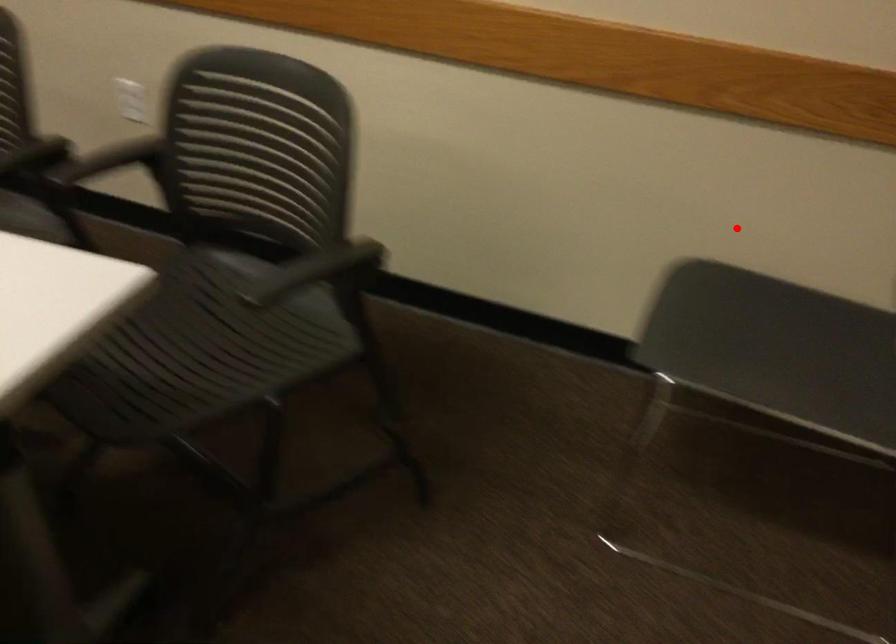
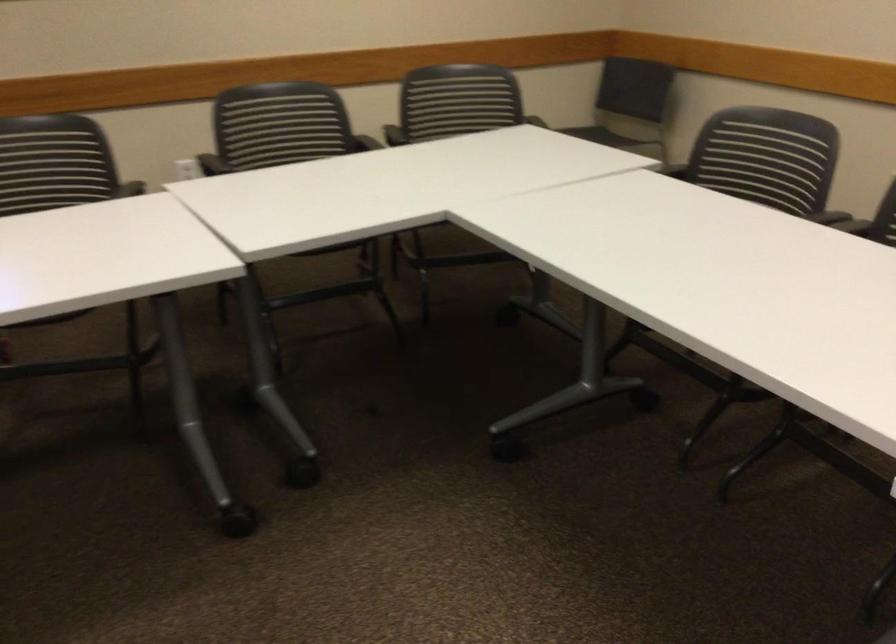
Where in the second image is the point corresponding to the highlighted location from the first image?

(529, 113)